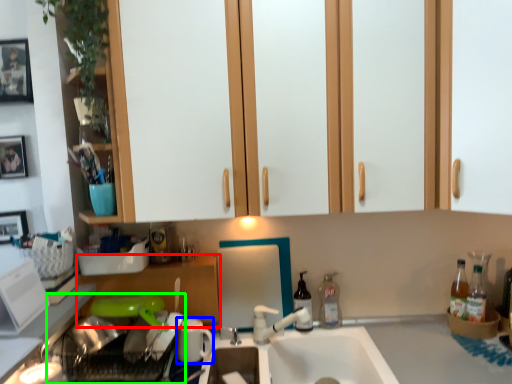
Question: Which object is positioned closest to cabinetry (highlighted by a red box)? Select from appliance (highlighted by a blue box) and dish washer (highlighted by a green box).

Choices:
 (A) appliance
 (B) dish washer

Answer: (B)